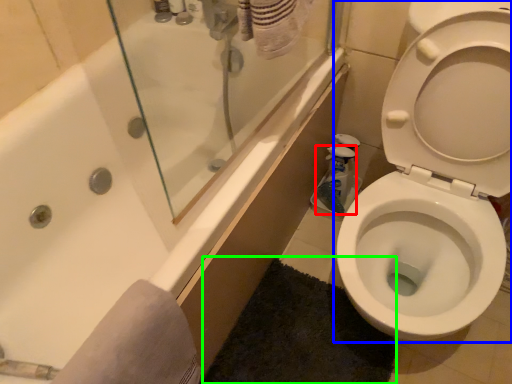
Question: Which object is positioned farthest from cleaning product (highlighted by a red box)? Select from toilet (highlighted by a blue box) and bath mat (highlighted by a green box).

Choices:
 (A) toilet
 (B) bath mat

Answer: (B)